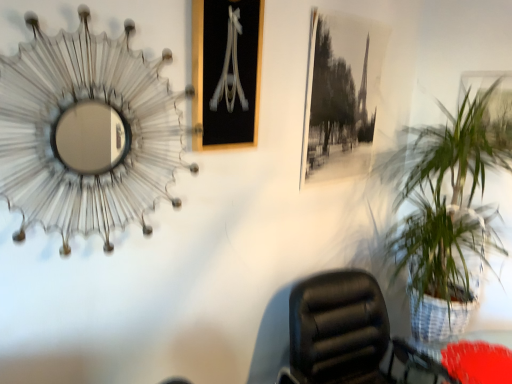
Question: Choose the correct answer: Is black leather chair at lower right inside metallic silver picture frame at upper right, marked as the third picture frame in a left-to-right arrangement, or outside it?

Choices:
 (A) inside
 (B) outside

Answer: (B)

Question: In the image, is black leather chair at lower right on the left side or the right side of metallic silver picture frame at upper right, marked as the third picture frame in a left-to-right arrangement?

Choices:
 (A) right
 (B) left

Answer: (B)

Question: Estimate the real-world distances between objects in this image. Which object is closer to the metallic wireframe mirror at upper left?

Choices:
 (A) black glass picture frame at upper center, the 1th picture frame viewed from the left
 (B) green leafy plant in woven basket at right
 (C) black leather chair at lower right
 (D) red fabric round table at lower right
 (E) metallic silver picture frame at upper right, positioned as the 1th picture frame in right-to-left order

Answer: (A)

Question: Considering the real-world distances, which object is farthest from the black glass picture frame at upper center, which ranks as the third picture frame in right-to-left order?

Choices:
 (A) black paper picture frame at upper center, which ranks as the 2th picture frame in left-to-right order
 (B) red fabric round table at lower right
 (C) green leafy plant in woven basket at right
 (D) metallic wireframe mirror at upper left
 (E) black leather chair at lower right

Answer: (B)